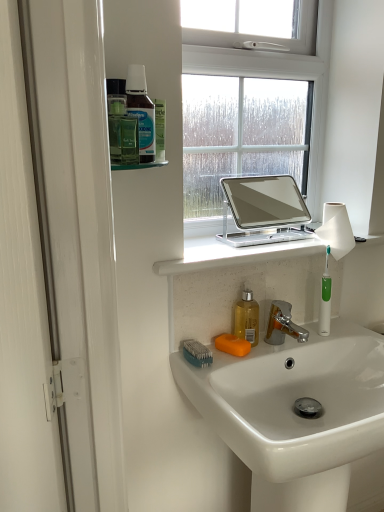
Find the location of a particular element. The image size is (384, 512). unoccupied region to the right of green plastic toothbrush at lower center is located at coordinates (254, 354).